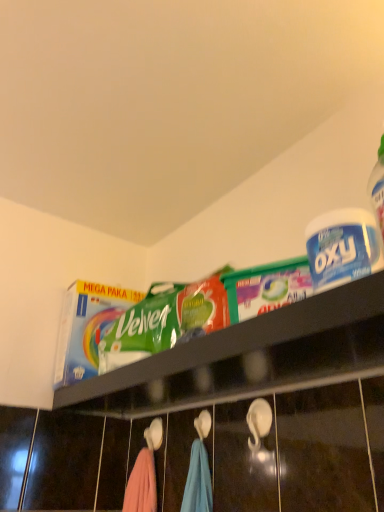
Question: Which direction should I rotate to look at green plastic bag of velvet at upper center?

Choices:
 (A) left
 (B) right

Answer: (B)

Question: Is white plastic container at upper right bigger than green plastic bag of velvet at upper center?

Choices:
 (A) yes
 (B) no

Answer: (B)

Question: Could green plastic bag of velvet at upper center be considered to be inside white plastic container at upper right?

Choices:
 (A) yes
 (B) no

Answer: (B)

Question: Does white plastic container at upper right come behind green plastic bag of velvet at upper center?

Choices:
 (A) yes
 (B) no

Answer: (A)

Question: Is white plastic container at upper right thinner than green plastic bag of velvet at upper center?

Choices:
 (A) no
 (B) yes

Answer: (B)

Question: Considering the relative positions of white plastic container at upper right and green plastic bag of velvet at upper center in the image provided, is white plastic container at upper right to the right of green plastic bag of velvet at upper center from the viewer's perspective?

Choices:
 (A) no
 (B) yes

Answer: (B)

Question: Is white plastic container at upper right wider than green plastic bag of velvet at upper center?

Choices:
 (A) yes
 (B) no

Answer: (B)

Question: Could you tell me if green plastic bag of velvet at upper center is facing white plastic container at upper right?

Choices:
 (A) yes
 (B) no

Answer: (B)

Question: Are green plastic bag of velvet at upper center and white plastic container at upper right located far from each other?

Choices:
 (A) yes
 (B) no

Answer: (B)

Question: Does green plastic bag of velvet at upper center appear on the right side of white plastic container at upper right?

Choices:
 (A) yes
 (B) no

Answer: (B)

Question: Is green plastic bag of velvet at upper center placed right next to white plastic container at upper right?

Choices:
 (A) yes
 (B) no

Answer: (B)

Question: From the image's perspective, would you say green plastic bag of velvet at upper center is shown under white plastic container at upper right?

Choices:
 (A) no
 (B) yes

Answer: (B)

Question: Considering the relative sizes of green plastic bag of velvet at upper center and white plastic container at upper right in the image provided, is green plastic bag of velvet at upper center shorter than white plastic container at upper right?

Choices:
 (A) yes
 (B) no

Answer: (A)

Question: In terms of height, does green plastic bag of velvet at upper center look taller or shorter compared to white plastic container at upper right?

Choices:
 (A) tall
 (B) short

Answer: (B)